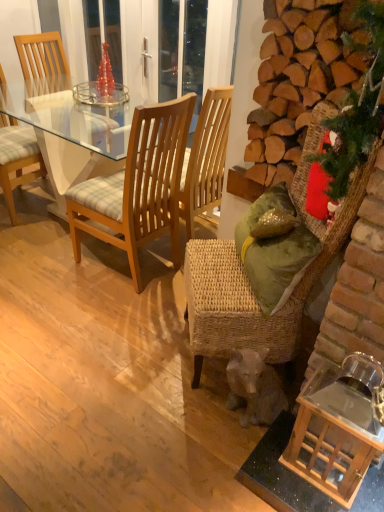
Question: Can you confirm if light brown wooden chair at left, the second chair in the left-to-right sequence, is smaller than green fabric christmas tree at right?

Choices:
 (A) yes
 (B) no

Answer: (B)

Question: Is light brown wooden chair at left, marked as the third chair in a right-to-left arrangement, bigger than green fabric christmas tree at right?

Choices:
 (A) no
 (B) yes

Answer: (B)

Question: Is light brown wooden chair at left, the second chair in the left-to-right sequence, to the right of green fabric christmas tree at right from the viewer's perspective?

Choices:
 (A) yes
 (B) no

Answer: (B)

Question: Is the depth of light brown wooden chair at left, the second chair in the left-to-right sequence, less than that of green fabric christmas tree at right?

Choices:
 (A) no
 (B) yes

Answer: (A)

Question: Is light brown wooden chair at left, the second chair in the left-to-right sequence, in contact with green fabric christmas tree at right?

Choices:
 (A) no
 (B) yes

Answer: (A)

Question: Can you confirm if light brown wooden chair at left, marked as the third chair in a right-to-left arrangement, is positioned to the left of green fabric christmas tree at right?

Choices:
 (A) yes
 (B) no

Answer: (A)

Question: Does wooden chair at left, arranged as the fourth chair when viewed from the right, appear on the left side of green fabric christmas tree at right?

Choices:
 (A) no
 (B) yes

Answer: (B)

Question: Considering the relative positions of wooden chair at left, arranged as the fourth chair when viewed from the right, and green fabric christmas tree at right in the image provided, is wooden chair at left, arranged as the fourth chair when viewed from the right, behind green fabric christmas tree at right?

Choices:
 (A) yes
 (B) no

Answer: (A)

Question: Is wooden chair at left, the first chair when ordered from left to right, thinner than green fabric christmas tree at right?

Choices:
 (A) no
 (B) yes

Answer: (A)

Question: Could you tell me if wooden chair at left, the first chair when ordered from left to right, is facing green fabric christmas tree at right?

Choices:
 (A) no
 (B) yes

Answer: (B)

Question: Is wooden chair at left, arranged as the fourth chair when viewed from the right, touching green fabric christmas tree at right?

Choices:
 (A) yes
 (B) no

Answer: (B)

Question: Is wooden chair at left, arranged as the fourth chair when viewed from the right, positioned with its back to green fabric christmas tree at right?

Choices:
 (A) yes
 (B) no

Answer: (B)

Question: Does green fabric christmas tree at right have a smaller size compared to green fabric pillow at right?

Choices:
 (A) no
 (B) yes

Answer: (B)